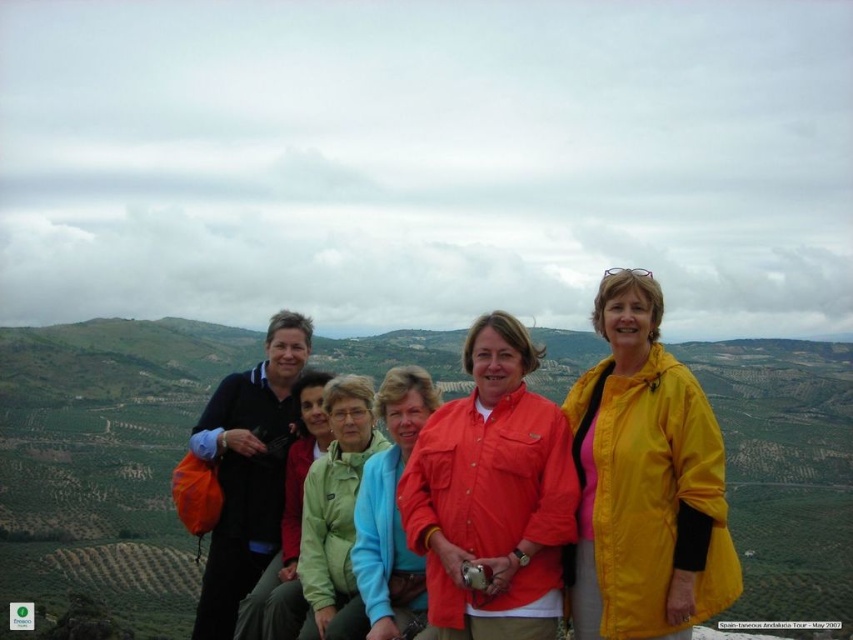
You are a photographer trying to capture a closeup of the two points in the image. The first point is at coordinates point (303, 632) and the second point is at point (374, 636). Which point should you focus on to ensure it appears closer in the photo?

Point (303, 632) is further to the viewer than point (374, 636), so focusing on point (303, 632) will make it appear closer in the photo.

You are standing at the origin point in the image coordinate system. You want to find the yellow matte jacket at right. In which direction should you move to locate it?

The yellow matte jacket at right is located at coordinate point (x=645, y=481), so you should move towards the right and slightly upwards from your current position at the origin.

You are standing at the point marked by the coordinates point (335,513). Looking around, you see the group of six individuals. Which person is standing closest to your current position?

The person closest to the point (335,513) is the green fabric jacket at center.